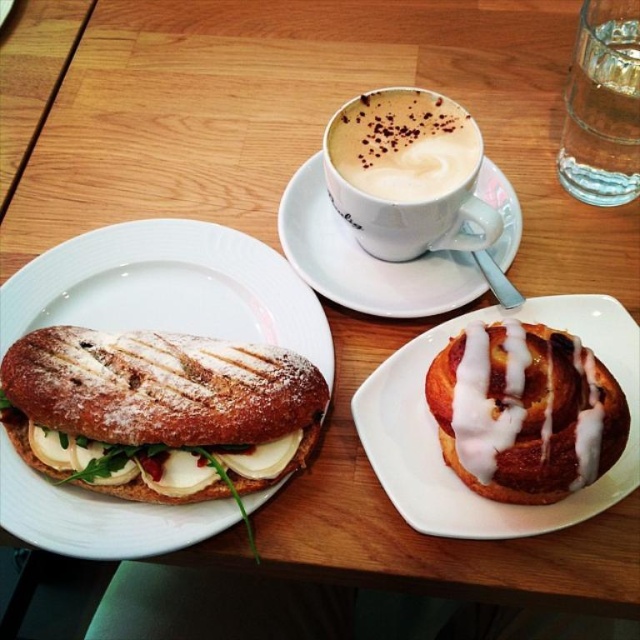
Who is lower down, white ceramic saucer at upper center or white frothy coffee at upper center?

Positioned lower is white ceramic saucer at upper center.

Does point (461, 275) come farther from viewer compared to point (376, 108)?

Yes, point (461, 275) is farther from viewer.

Who is more forward, [333,237] or [372,195]?

Point [372,195]

Locate an element on the screen. The width and height of the screenshot is (640, 640). white ceramic saucer at upper center is located at coordinates (365, 259).

Is white ceramic plate at left positioned in front of white ceramic saucer at upper center?

Yes, it is.

Who is more forward, [204,509] or [381,280]?

Point [204,509] is more forward.

Measure the distance between point (163, 509) and camera.

20.46 inches

The image size is (640, 640). I want to click on white ceramic plate at left, so click(x=176, y=285).

Measure the distance from white ceramic saucer at upper center to clear glass water at upper right.

7.13 inches

Can you confirm if white ceramic saucer at upper center is thinner than clear glass water at upper right?

No.

I want to click on white ceramic saucer at upper center, so click(x=365, y=259).